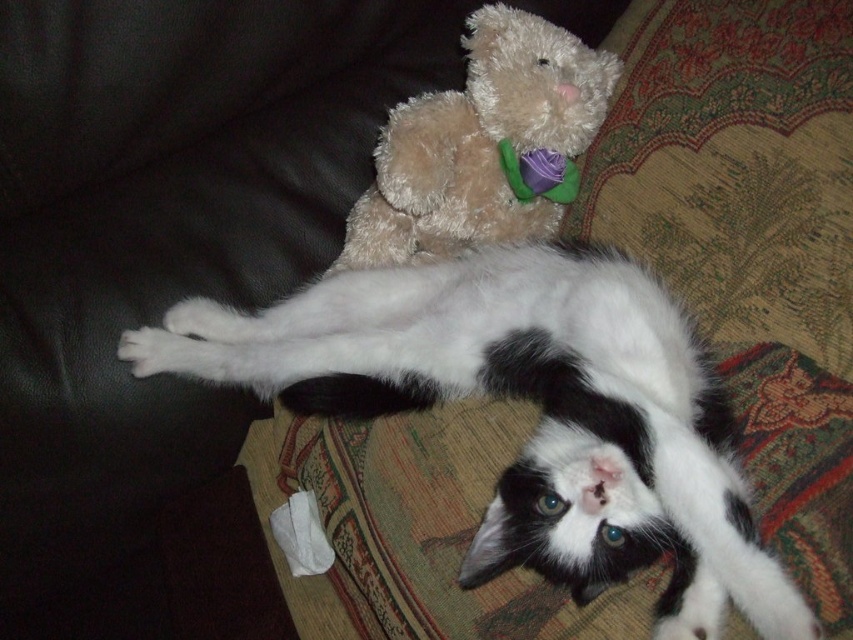
What do you see at coordinates (541, 417) in the screenshot? The image size is (853, 640). I see `white soft fur cat at center` at bounding box center [541, 417].

Does white soft fur cat at center have a smaller size compared to fuzzy brown teddy bear at upper center?

Incorrect, white soft fur cat at center is not smaller in size than fuzzy brown teddy bear at upper center.

Who is more distant from viewer, (x=811, y=620) or (x=508, y=83)?

Point (x=508, y=83)

Image resolution: width=853 pixels, height=640 pixels. Identify the location of white soft fur cat at center. (541, 417).